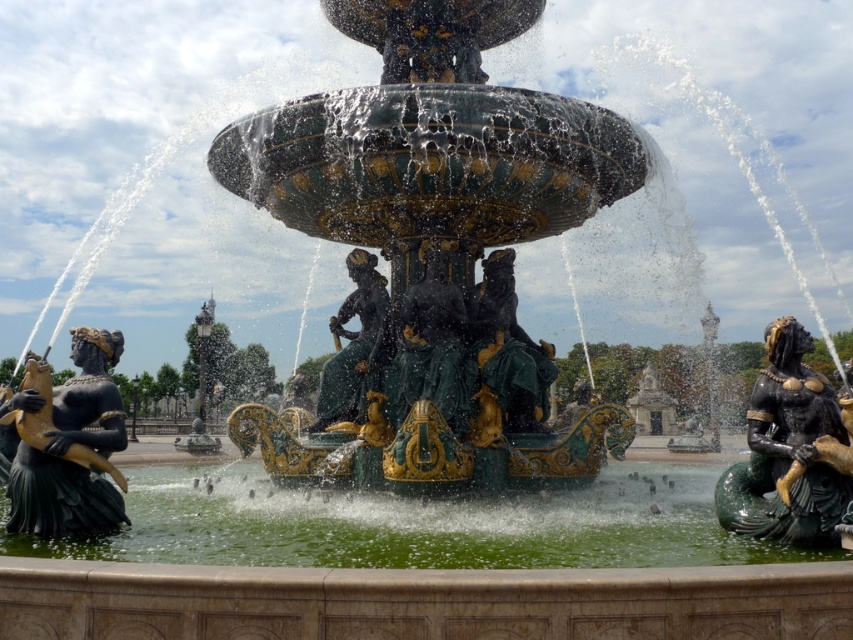
Is black polished statue at left below green patina statue at center?

Indeed, black polished statue at left is positioned under green patina statue at center.

Which is more to the right, black polished statue at left or green patina statue at center?

From the viewer's perspective, green patina statue at center appears more on the right side.

Image resolution: width=853 pixels, height=640 pixels. Describe the element at coordinates (68, 444) in the screenshot. I see `black polished statue at left` at that location.

Find the location of a particular element. black polished statue at left is located at coordinates (68, 444).

Is black polished statue at left shorter than black polished mermaid at right?

Yes, black polished statue at left is shorter than black polished mermaid at right.

Is black polished statue at left wider than black polished mermaid at right?

Yes, black polished statue at left is wider than black polished mermaid at right.

Does point (45, 465) come farther from viewer compared to point (807, 493)?

Yes, it is behind point (807, 493).

Find the location of a particular element. This screenshot has width=853, height=640. black polished statue at left is located at coordinates (68, 444).

Measure the distance between black polished mermaid at right and gold polished statue at center.

A distance of 98.28 feet exists between black polished mermaid at right and gold polished statue at center.

Does black polished mermaid at right have a smaller size compared to gold polished statue at center?

Actually, black polished mermaid at right might be larger than gold polished statue at center.

The height and width of the screenshot is (640, 853). What do you see at coordinates (786, 449) in the screenshot?
I see `black polished mermaid at right` at bounding box center [786, 449].

Image resolution: width=853 pixels, height=640 pixels. In order to click on black polished mermaid at right in this screenshot , I will do `click(786, 449)`.